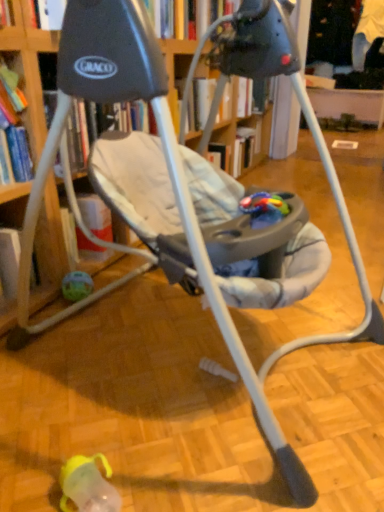
Image resolution: width=384 pixels, height=512 pixels. Find the location of `translucent plastic ball at lower left, the first toy in the bottom-to-top sequence`. translucent plastic ball at lower left, the first toy in the bottom-to-top sequence is located at coordinates (77, 286).

What do you see at coordinates (77, 286) in the screenshot? I see `translucent plastic ball at lower left, placed as the 2th toy when sorted from right to left` at bounding box center [77, 286].

The height and width of the screenshot is (512, 384). What do you see at coordinates (264, 208) in the screenshot?
I see `rubberized plastic teething toy at center, which ranks as the second toy in bottom-to-top order` at bounding box center [264, 208].

You are a GUI agent. You are given a task and a screenshot of the screen. Output one action in this format:
    pyautogui.click(x=<x>, y=<y>)
    Task: Click on the rubberized plastic teething toy at center, the 1th toy from the top
    Image resolution: width=384 pixels, height=512 pixels.
    Given the screenshot: What is the action you would take?
    pyautogui.click(x=264, y=208)

How much space does rubberized plastic teething toy at center, which ranks as the second toy in bottom-to-top order, occupy vertically?

2.25 inches.

What is the approximate width of rubberized plastic teething toy at center, acting as the second toy starting from the left?

rubberized plastic teething toy at center, acting as the second toy starting from the left, is 5.16 inches in width.

Identify the location of translucent plastic ball at lower left, the second toy positioned from the front. (77, 286).

Is rubberized plastic teething toy at center, acting as the 2th toy starting from the back, to the left of translucent plastic ball at lower left, placed as the 2th toy when sorted from right to left, from the viewer's perspective?

No, rubberized plastic teething toy at center, acting as the 2th toy starting from the back, is not to the left of translucent plastic ball at lower left, placed as the 2th toy when sorted from right to left.

Considering the relative positions of rubberized plastic teething toy at center, acting as the second toy starting from the left, and translucent plastic ball at lower left, the second toy when ordered from top to bottom, in the image provided, is rubberized plastic teething toy at center, acting as the second toy starting from the left, in front of translucent plastic ball at lower left, the second toy when ordered from top to bottom,?

Yes, rubberized plastic teething toy at center, acting as the second toy starting from the left, is closer to the camera.

Considering the points (273, 198) and (68, 273), which point is behind, point (273, 198) or point (68, 273)?

Positioned behind is point (68, 273).

From the image's perspective, which one is positioned higher, rubberized plastic teething toy at center, which ranks as the second toy in bottom-to-top order, or translucent plastic ball at lower left, the second toy when ordered from top to bottom?

rubberized plastic teething toy at center, which ranks as the second toy in bottom-to-top order, is shown above in the image.

From a real-world perspective, is rubberized plastic teething toy at center, which appears as the 1th toy when viewed from the right, physically located above or below translucent plastic ball at lower left, the second toy positioned from the front?

rubberized plastic teething toy at center, which appears as the 1th toy when viewed from the right, is above translucent plastic ball at lower left, the second toy positioned from the front.

Which object is thinner, rubberized plastic teething toy at center, the 1th toy from the top, or translucent plastic ball at lower left, the first toy in the bottom-to-top sequence?

Thinner between the two is translucent plastic ball at lower left, the first toy in the bottom-to-top sequence.

Looking at this image, is rubberized plastic teething toy at center, acting as the second toy starting from the left, taller than translucent plastic ball at lower left, the second toy positioned from the front?

Incorrect, the height of rubberized plastic teething toy at center, acting as the second toy starting from the left, is not larger of that of translucent plastic ball at lower left, the second toy positioned from the front.

Which of these two, rubberized plastic teething toy at center, acting as the second toy starting from the left, or translucent plastic ball at lower left, the first toy positioned from the back, is bigger?

translucent plastic ball at lower left, the first toy positioned from the back, is bigger.

Would you say rubberized plastic teething toy at center, which appears as the 1th toy when viewed from the right, is outside translucent plastic ball at lower left, the second toy positioned from the front?

Absolutely, rubberized plastic teething toy at center, which appears as the 1th toy when viewed from the right, is external to translucent plastic ball at lower left, the second toy positioned from the front.

Is rubberized plastic teething toy at center, acting as the 2th toy starting from the back, not close to translucent plastic ball at lower left, the second toy when ordered from top to bottom?

That's not correct — rubberized plastic teething toy at center, acting as the 2th toy starting from the back, is a little close to translucent plastic ball at lower left, the second toy when ordered from top to bottom.

Is rubberized plastic teething toy at center, which appears as the 1th toy when viewed from the right, oriented towards translucent plastic ball at lower left, the 1th toy from the left?

No, rubberized plastic teething toy at center, which appears as the 1th toy when viewed from the right, does not turn towards translucent plastic ball at lower left, the 1th toy from the left.

What's the angular difference between rubberized plastic teething toy at center, acting as the second toy starting from the left, and translucent plastic ball at lower left, the first toy positioned from the back,'s facing directions?

They differ by 10.7 degrees in their facing directions.

How much distance is there between rubberized plastic teething toy at center, which ranks as the second toy in bottom-to-top order, and translucent plastic ball at lower left, the first toy in the bottom-to-top sequence?

A distance of 28.51 inches exists between rubberized plastic teething toy at center, which ranks as the second toy in bottom-to-top order, and translucent plastic ball at lower left, the first toy in the bottom-to-top sequence.

Find the location of a particular element. This screenshot has height=512, width=384. toy above the translucent plastic ball at lower left, the first toy positioned from the back (from a real-world perspective) is located at coordinates (264, 208).

Considering the relative positions of translucent plastic ball at lower left, the second toy positioned from the front, and rubberized plastic teething toy at center, positioned as the 1th toy in front-to-back order, in the image provided, is translucent plastic ball at lower left, the second toy positioned from the front, to the left of rubberized plastic teething toy at center, positioned as the 1th toy in front-to-back order, from the viewer's perspective?

Correct, you'll find translucent plastic ball at lower left, the second toy positioned from the front, to the left of rubberized plastic teething toy at center, positioned as the 1th toy in front-to-back order.

Considering the relative positions of translucent plastic ball at lower left, the first toy in the bottom-to-top sequence, and rubberized plastic teething toy at center, the 1th toy from the top, in the image provided, is translucent plastic ball at lower left, the first toy in the bottom-to-top sequence, behind rubberized plastic teething toy at center, the 1th toy from the top,?

Yes, translucent plastic ball at lower left, the first toy in the bottom-to-top sequence, is behind rubberized plastic teething toy at center, the 1th toy from the top.

Is point (90, 277) positioned in front of point (271, 203)?

No.

From the image's perspective, is translucent plastic ball at lower left, placed as the 2th toy when sorted from right to left, over rubberized plastic teething toy at center, which ranks as the second toy in bottom-to-top order?

No, from the image's perspective, translucent plastic ball at lower left, placed as the 2th toy when sorted from right to left, is not on top of rubberized plastic teething toy at center, which ranks as the second toy in bottom-to-top order.

From a real-world perspective, is translucent plastic ball at lower left, the second toy positioned from the front, on rubberized plastic teething toy at center, which appears as the 1th toy when viewed from the right?

No, from a real-world perspective, translucent plastic ball at lower left, the second toy positioned from the front, is not above rubberized plastic teething toy at center, which appears as the 1th toy when viewed from the right.

Based on the photo, is translucent plastic ball at lower left, the second toy positioned from the front, wider or thinner than rubberized plastic teething toy at center, which ranks as the second toy in bottom-to-top order?

translucent plastic ball at lower left, the second toy positioned from the front, is thinner than rubberized plastic teething toy at center, which ranks as the second toy in bottom-to-top order.

Can you confirm if translucent plastic ball at lower left, the second toy when ordered from top to bottom, is taller than rubberized plastic teething toy at center, positioned as the 1th toy in front-to-back order?

Yes.

Does translucent plastic ball at lower left, placed as the 2th toy when sorted from right to left, have a smaller size compared to rubberized plastic teething toy at center, positioned as the 1th toy in front-to-back order?

Actually, translucent plastic ball at lower left, placed as the 2th toy when sorted from right to left, might be larger than rubberized plastic teething toy at center, positioned as the 1th toy in front-to-back order.

Which is correct: translucent plastic ball at lower left, the 1th toy from the left, is inside rubberized plastic teething toy at center, positioned as the 1th toy in front-to-back order, or outside of it?

translucent plastic ball at lower left, the 1th toy from the left, is located beyond the bounds of rubberized plastic teething toy at center, positioned as the 1th toy in front-to-back order.

Are translucent plastic ball at lower left, the first toy positioned from the back, and rubberized plastic teething toy at center, positioned as the 1th toy in front-to-back order, making contact?

No, translucent plastic ball at lower left, the first toy positioned from the back, is not with rubberized plastic teething toy at center, positioned as the 1th toy in front-to-back order.

Is translucent plastic ball at lower left, placed as the 2th toy when sorted from right to left, turned away from rubberized plastic teething toy at center, acting as the second toy starting from the left?

No, translucent plastic ball at lower left, placed as the 2th toy when sorted from right to left, is not facing away from rubberized plastic teething toy at center, acting as the second toy starting from the left.

Consider the image. How different are the orientations of translucent plastic ball at lower left, the second toy positioned from the front, and rubberized plastic teething toy at center, which appears as the 1th toy when viewed from the right, in degrees?

10.7 degrees separate the facing orientations of translucent plastic ball at lower left, the second toy positioned from the front, and rubberized plastic teething toy at center, which appears as the 1th toy when viewed from the right.

Measure the distance between translucent plastic ball at lower left, the second toy positioned from the front, and rubberized plastic teething toy at center, acting as the 2th toy starting from the back.

translucent plastic ball at lower left, the second toy positioned from the front, and rubberized plastic teething toy at center, acting as the 2th toy starting from the back, are 28.51 inches apart.

The width and height of the screenshot is (384, 512). In order to click on toy below the rubberized plastic teething toy at center, acting as the 2th toy starting from the back (from a real-world perspective) in this screenshot , I will do `click(77, 286)`.

Find the location of `toy on the right of translucent plastic ball at lower left, the 1th toy from the left`. toy on the right of translucent plastic ball at lower left, the 1th toy from the left is located at coordinates (264, 208).

Locate an element on the screen. This screenshot has width=384, height=512. toy located above the translucent plastic ball at lower left, the second toy positioned from the front (from a real-world perspective) is located at coordinates (264, 208).